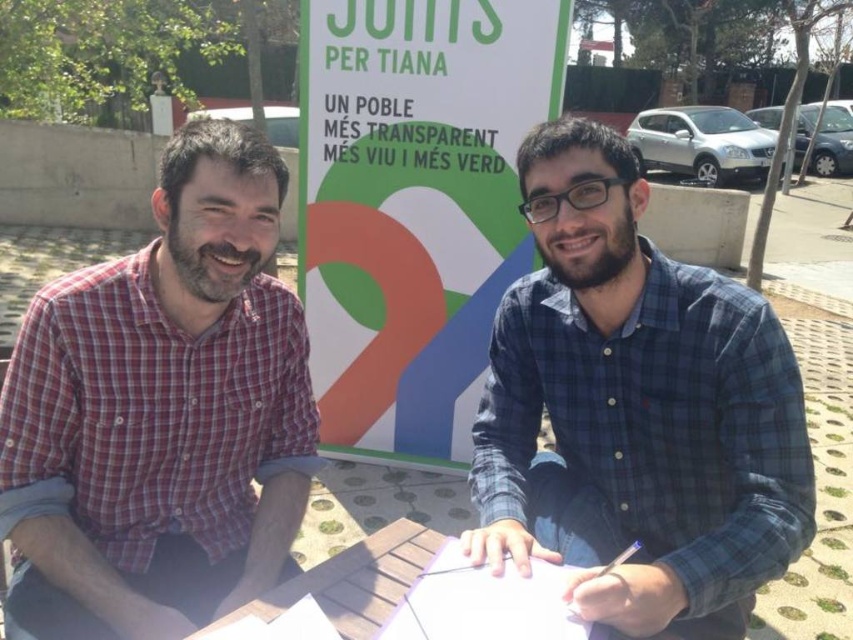
Question: Which of the following is the closest to the observer?

Choices:
 (A) blue plaid shirt at center
 (B) plaid cotton shirt at left
 (C) green paper sign at center

Answer: (A)

Question: Does plaid cotton shirt at left appear on the left side of green paper sign at center?

Choices:
 (A) yes
 (B) no

Answer: (A)

Question: Which of the following is the farthest from the observer?

Choices:
 (A) wooden picnic table at center
 (B) blue plaid shirt at center

Answer: (B)

Question: Is the position of plaid cotton shirt at left more distant than that of blue plaid shirt at center?

Choices:
 (A) no
 (B) yes

Answer: (B)

Question: Does green paper sign at center have a smaller size compared to wooden picnic table at center?

Choices:
 (A) no
 (B) yes

Answer: (A)

Question: Which point is farther to the camera?

Choices:
 (A) plaid cotton shirt at left
 (B) blue plaid shirt at center
 (C) green paper sign at center

Answer: (C)